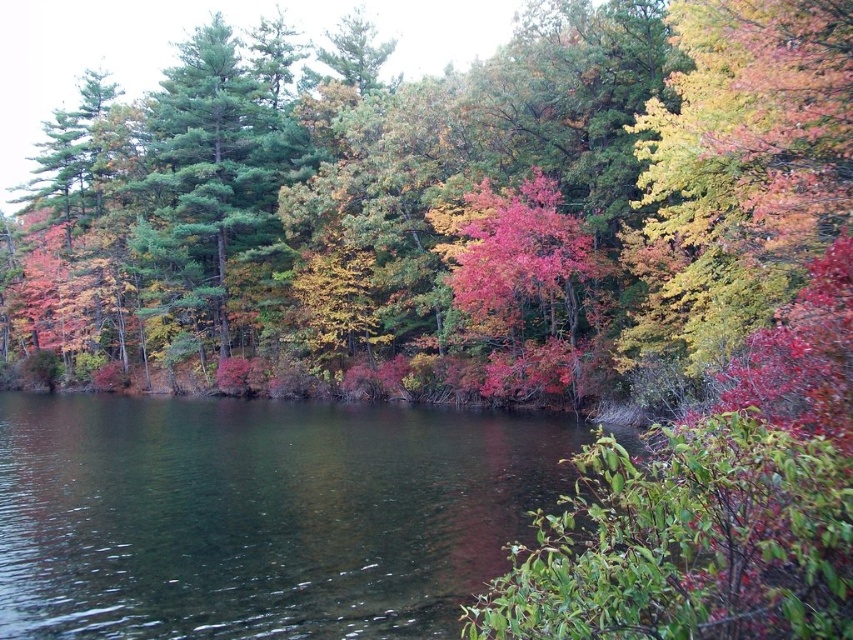
Consider the image. You are a hiker who wants to take a photo of the clear water at center and the green matte tree at upper left in the same frame. The camera you have can capture a maximum distance of 25 meters between the nearest and farthest objects in focus. Will you be able to capture both objects in focus without adjusting your camera settings?

The clear water at center and green matte tree at upper left are 24.39 meters apart from each other. Since the camera can capture up to 25 meters between the nearest and farthest objects, the distance of 24.39 meters is within the camera range. Therefore, you can capture both objects in focus without adjusting your camera settings.

In the scene shown: You are an artist planning to paint the scene. You want to ensure the clear water at center and the green matte tree at upper left are proportionally accurate. Which object should you draw first to maintain proper scaling, considering their relative sizes?

Since the clear water at center is not as tall as the green matte tree at upper left, you should draw the green matte tree at upper left first as it is taller. This ensures that the tree is scaled appropriately before adjusting the size of the smaller clear water at center accordingly.

You are an artist planning to paint the scene. You want to ensure the clear water at center and the green matte tree at upper left are proportionally accurate. Which object should you paint first to maintain the correct size relationship between them?

You should paint the green matte tree at upper left first because the clear water at center has a smaller size compared to it, allowing you to establish the larger reference point before adding the smaller element.